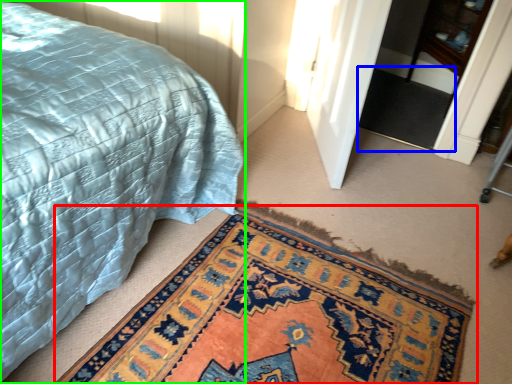
Question: Which is nearer to the mat (highlighted by a red box)? doormat (highlighted by a blue box) or bed (highlighted by a green box).

Choices:
 (A) doormat
 (B) bed

Answer: (B)